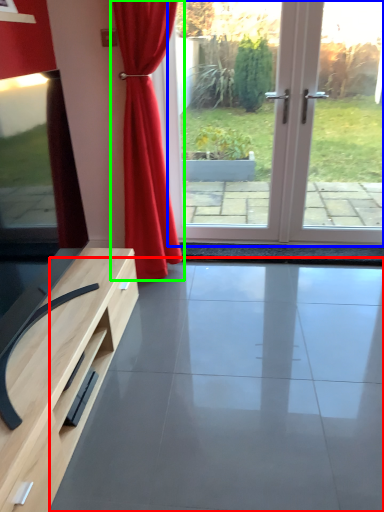
Question: Estimate the real-world distances between objects in this image. Which object is farther from concrete (highlighted by a red box), screen door (highlighted by a blue box) or curtain (highlighted by a green box)?

Choices:
 (A) screen door
 (B) curtain

Answer: (A)